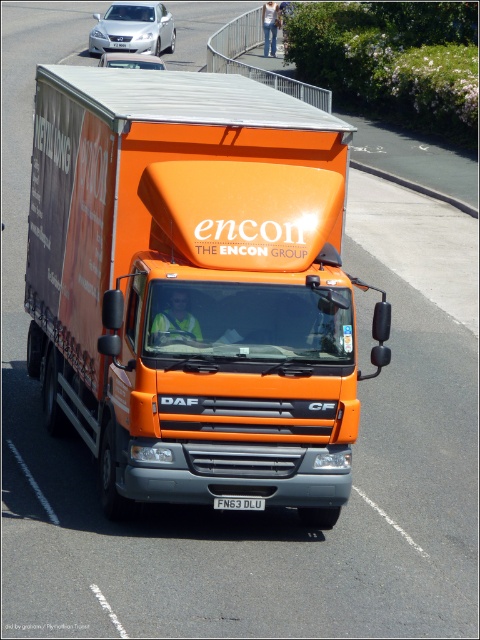
You are a traffic officer observing a vehicle on the road. You notice an orange matte truck at center and a white plastic license plate at center. Which object takes up more space in the image?

The orange matte truck at center has a larger size compared to the white plastic license plate at center, so it takes up more space in the image.

You are the driver of the orange DAF CF truck. You notice a silver metallic sedan at upper left. According to the scene description, where exactly is the silver metallic sedan positioned relative to your truck?

The silver metallic sedan at upper left is located at point coordinates (x=132, y=28) relative to the truck.